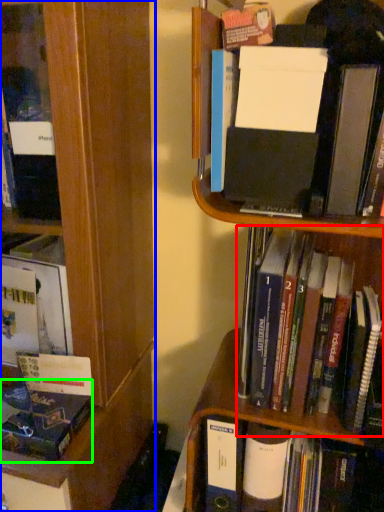
Question: Which is nearer to the book (highlighted by a red box)? bookcase (highlighted by a blue box) or book (highlighted by a green box).

Choices:
 (A) bookcase
 (B) book

Answer: (A)